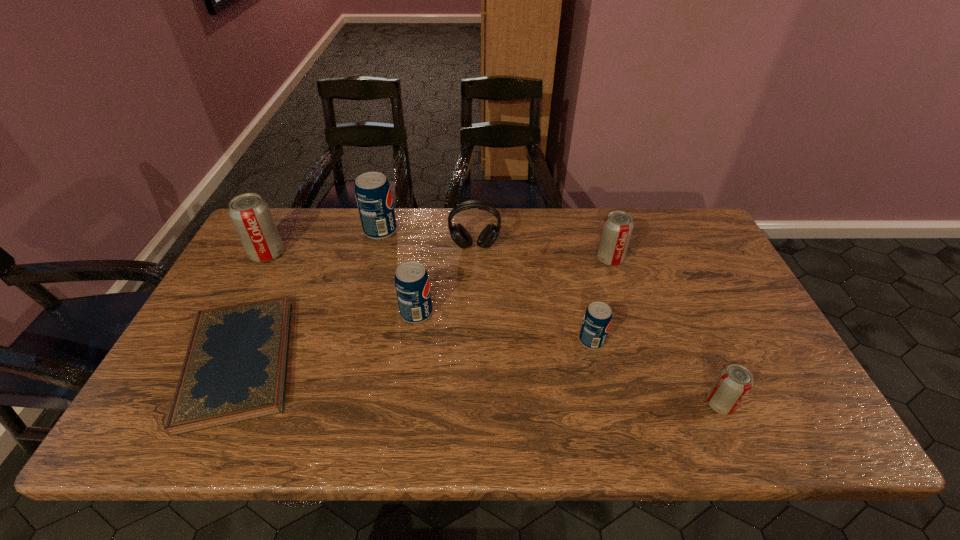
What are the coordinates of `vacant position located on the right of the fourth soda can from left to right` in the screenshot? It's located at (745, 341).

This screenshot has height=540, width=960. I want to click on vacant position located 0.130m on the right of the rightmost gray soda can, so click(791, 404).

The height and width of the screenshot is (540, 960). In order to click on free space located 0.240m on the back of the paperback book in this screenshot , I will do `click(293, 248)`.

The width and height of the screenshot is (960, 540). In order to click on headset located in the far edge section of the desktop in this screenshot , I will do `click(490, 233)`.

Image resolution: width=960 pixels, height=540 pixels. Identify the location of soda can at the near edge. (735, 381).

Find the location of `paperback book present at the near edge`. paperback book present at the near edge is located at coordinates (235, 368).

Identify the location of soda can present at the left edge. This screenshot has height=540, width=960. (250, 214).

Find the location of a particular element. paperback book that is at the left edge is located at coordinates (235, 368).

The image size is (960, 540). Find the location of `object that is at the far left corner`. object that is at the far left corner is located at coordinates (250, 214).

You are a GUI agent. You are given a task and a screenshot of the screen. Output one action in this format:
    pyautogui.click(x=<x>, y=<y>)
    Task: Click on the object positioned at the near left corner
    
    Given the screenshot: What is the action you would take?
    click(x=235, y=368)